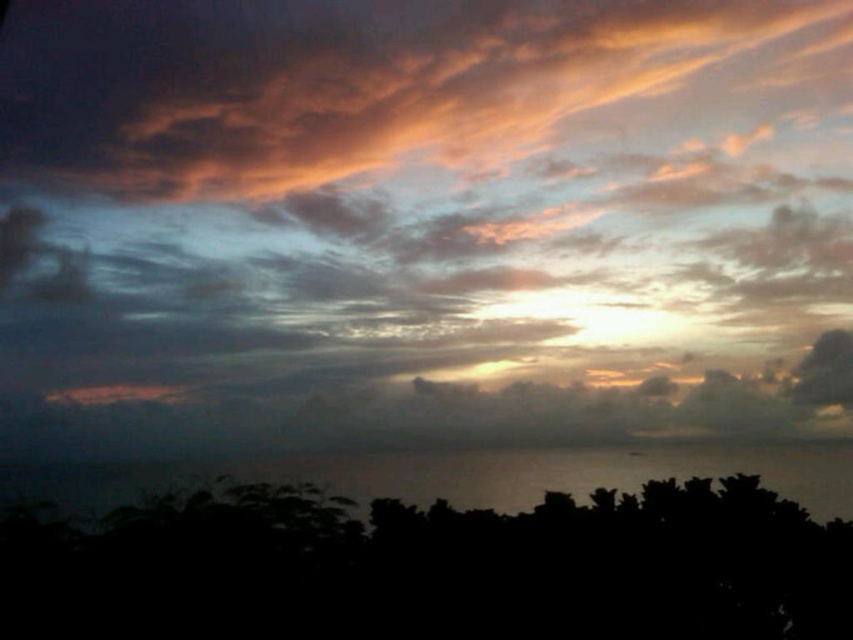
Question: Is cloudy sky at upper center below black matte tree at lower center?

Choices:
 (A) no
 (B) yes

Answer: (A)

Question: Which object is farther from the camera taking this photo?

Choices:
 (A) black matte tree at lower center
 (B) cloudy sky at upper center

Answer: (B)

Question: Among these points, which one is farthest from the camera?

Choices:
 (A) click(33, 3)
 (B) click(160, 515)

Answer: (A)

Question: Is cloudy sky at upper center smaller than black matte tree at lower center?

Choices:
 (A) no
 (B) yes

Answer: (B)

Question: Which of the following is the closest to the observer?

Choices:
 (A) cloudy sky at upper center
 (B) black matte tree at lower center

Answer: (B)

Question: Is cloudy sky at upper center positioned at the back of black matte tree at lower center?

Choices:
 (A) yes
 (B) no

Answer: (A)